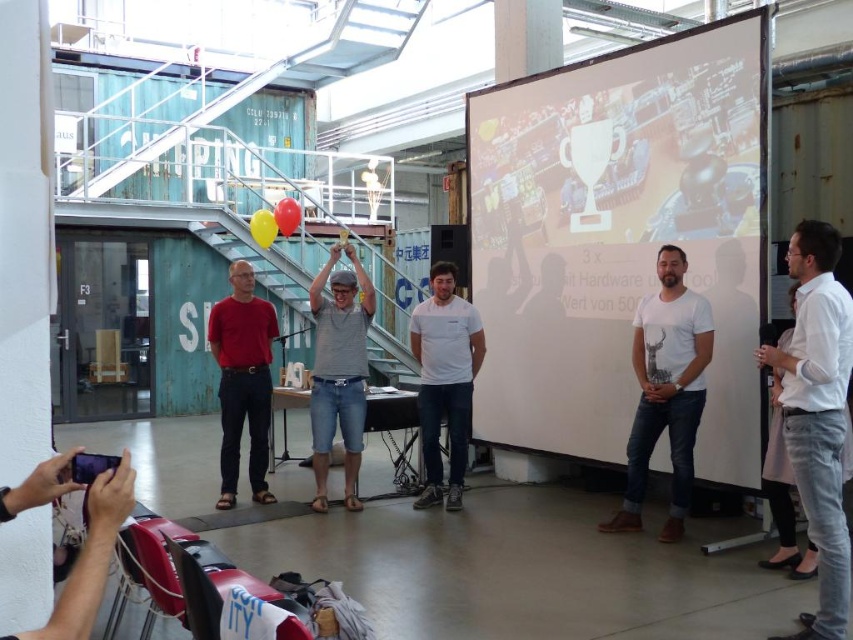
Question: Is white matte projection screen at center bigger than white matte t-shirt at center?

Choices:
 (A) no
 (B) yes

Answer: (B)

Question: Among these points, which one is nearest to the camera?

Choices:
 (A) (701, 308)
 (B) (480, 330)

Answer: (A)

Question: Among these objects, which one is nearest to the camera?

Choices:
 (A) white cotton t-shirt at center
 (B) gray cotton t-shirt at center
 (C) white matte projection screen at center

Answer: (C)

Question: Can you confirm if white matte projection screen at center is smaller than white matte t-shirt at center?

Choices:
 (A) no
 (B) yes

Answer: (A)

Question: Is white shirt at right smaller than white matte t-shirt at center?

Choices:
 (A) yes
 (B) no

Answer: (A)

Question: Which point is farther to the camera?

Choices:
 (A) (827, 352)
 (B) (314, 481)
 (C) (425, 483)
 (D) (233, 451)

Answer: (B)